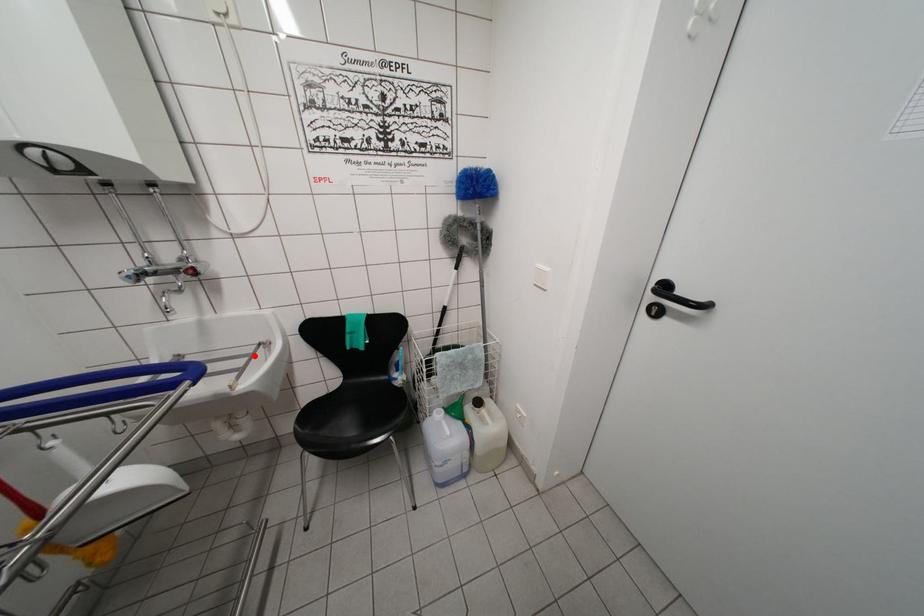
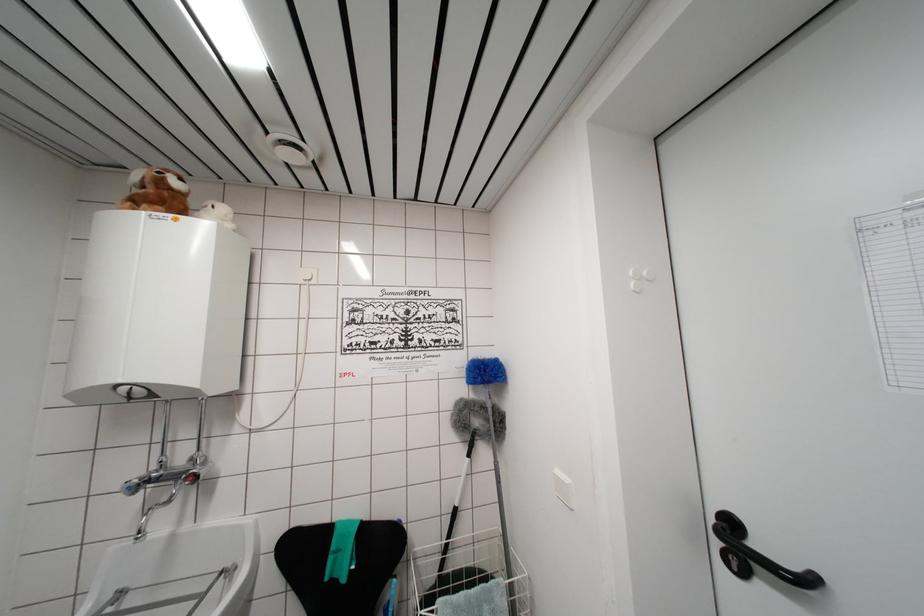
Question: I am providing you with two images of the same scene from different viewpoints. A red point is marked on the first image. Can you still see the location of the red point in image 2?

Choices:
 (A) Yes
 (B) No

Answer: (A)